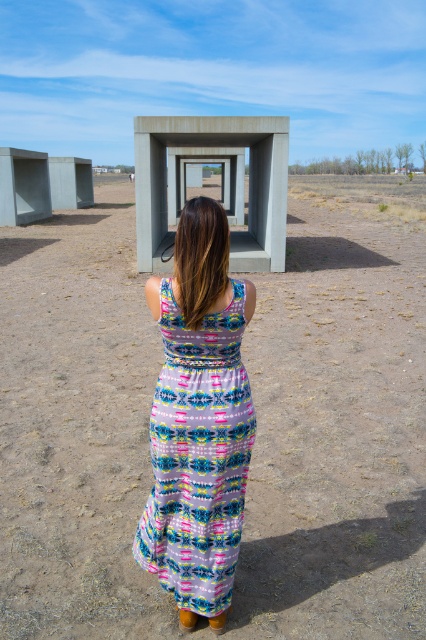
Can you confirm if brown sandy dirt at center is taller than concrete at center?

No.

Who is lower down, brown sandy dirt at center or concrete at center?

brown sandy dirt at center is below.

Where is `brown sandy dirt at center`? brown sandy dirt at center is located at coordinates (336, 436).

You are a GUI agent. You are given a task and a screenshot of the screen. Output one action in this format:
    pyautogui.click(x=<x>, y=<y>)
    Task: Click on the brown sandy dirt at center
    This screenshot has height=640, width=426.
    Given the screenshot: What is the action you would take?
    pyautogui.click(x=336, y=436)

Which is more to the right, printed fabric dress at center or concrete at center?

printed fabric dress at center is more to the right.

Is printed fabric dress at center positioned in front of concrete at center?

Yes.

Does point (164, 444) lie behind point (250, 204)?

No, (164, 444) is closer to viewer.

I want to click on printed fabric dress at center, so click(x=198, y=456).

Can you confirm if brown sandy dirt at center is wider than printed fabric dress at center?

Correct, the width of brown sandy dirt at center exceeds that of printed fabric dress at center.

Between brown sandy dirt at center and printed fabric dress at center, which one has more height?

brown sandy dirt at center

Does point (3, 600) lie in front of point (210, 355)?

No, (3, 600) is behind (210, 355).

Where is `brown sandy dirt at center`? Image resolution: width=426 pixels, height=640 pixels. brown sandy dirt at center is located at coordinates (336, 436).